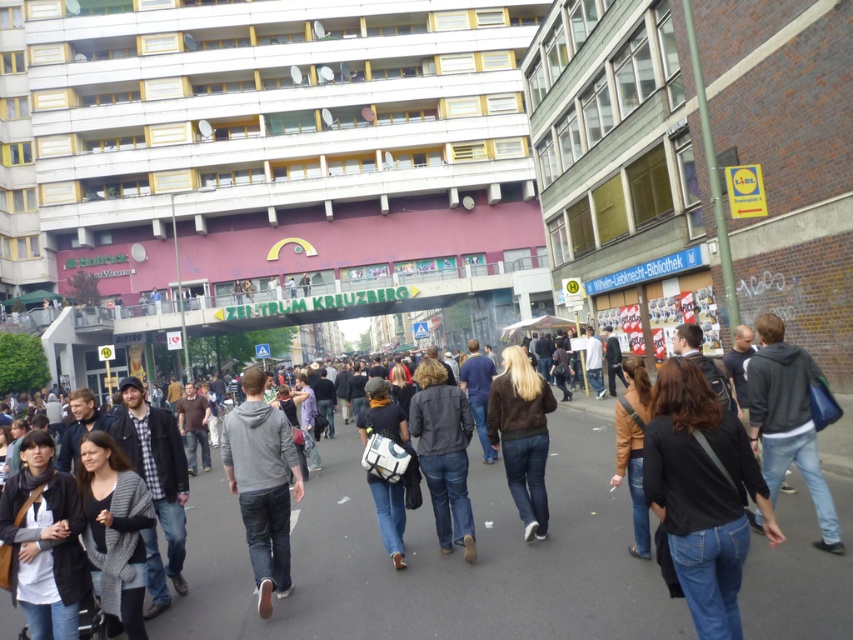
Does black denim jeans at center appear on the right side of white cotton shirt at lower left?

Yes, black denim jeans at center is to the right of white cotton shirt at lower left.

Between point (692, 442) and point (45, 472), which one is positioned in front?

Point (692, 442) is more forward.

In order to click on black denim jeans at center in this screenshot , I will do `click(701, 493)`.

What do you see at coordinates (262, 484) in the screenshot?
I see `gray hoodie at center` at bounding box center [262, 484].

Between gray hoodie at center and gray knitted sweater at lower left, which one has less height?

Standing shorter between the two is gray knitted sweater at lower left.

The height and width of the screenshot is (640, 853). What are the coordinates of `gray hoodie at center` in the screenshot? It's located at (262, 484).

Does gray hoodie at center have a larger size compared to dark gray hoodie at center?

Correct, gray hoodie at center is larger in size than dark gray hoodie at center.

Can you confirm if gray hoodie at center is positioned below dark gray hoodie at center?

Correct, gray hoodie at center is located below dark gray hoodie at center.

What do you see at coordinates (262, 484) in the screenshot? I see `gray hoodie at center` at bounding box center [262, 484].

Locate an element on the screen. The width and height of the screenshot is (853, 640). gray hoodie at center is located at coordinates (262, 484).